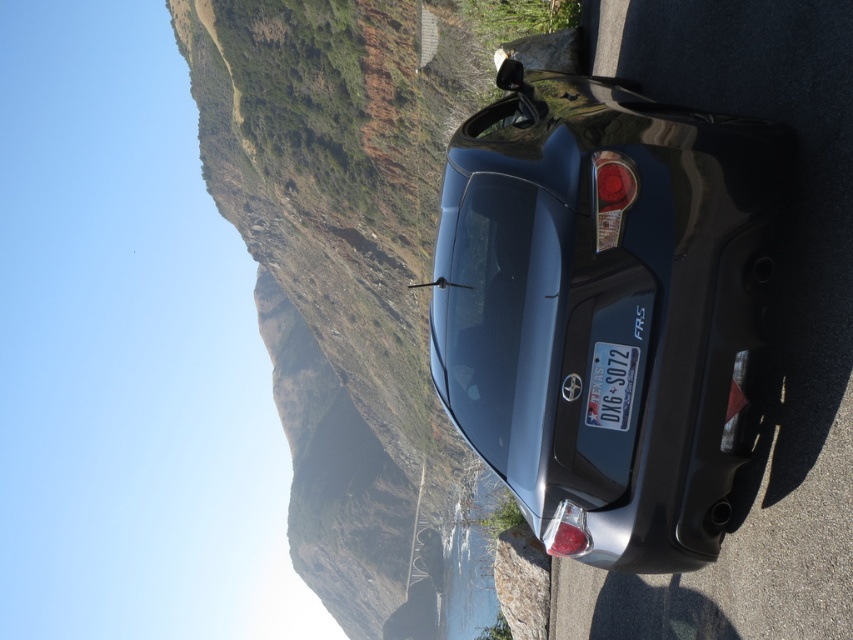
You are standing at the point marked by the coordinates point (602,305) in the image. What object are you facing?

The point (602,305) indicates the satin black car at center, so you are facing the satin black car at center.

You are a photographer trying to capture the entire scene of the satin black car at center and the metallic blue license plate at center in one frame. Given their sizes, which object will appear bigger in your photo?

The satin black car at center will appear bigger in the photo because it has a larger size compared to the metallic blue license plate at center.

You are a traffic officer who needs to verify the license plate of the satin black car at center. Can you see the metallic blue license plate at center clearly from your current position?

The satin black car at center is in front of the metallic blue license plate at center, so the license plate may be blocked by the car, making it difficult to see clearly.